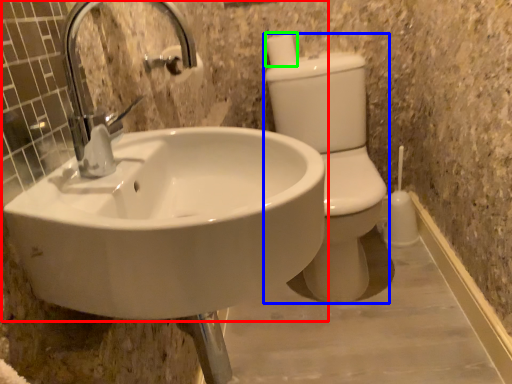
Question: Which object is positioned farthest from sink (highlighted by a red box)? Select from toilet bowl (highlighted by a blue box) and toilet paper (highlighted by a green box).

Choices:
 (A) toilet bowl
 (B) toilet paper

Answer: (B)